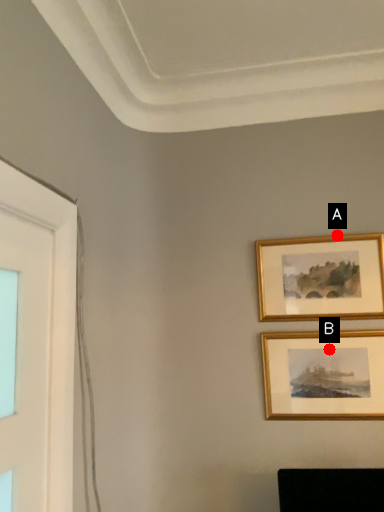
Question: Two points are circled on the image, labeled by A and B beside each circle. Which point appears farthest from the camera in this image?

Choices:
 (A) A is further
 (B) B is further

Answer: (A)